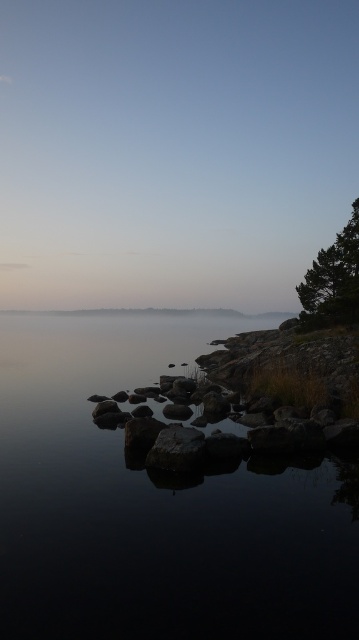
Question: Which of the following is the closest to the observer?

Choices:
 (A) (190, 465)
 (B) (193, 316)

Answer: (A)

Question: Where is transparent water at center located in relation to green textured tree at right in the image?

Choices:
 (A) right
 (B) left

Answer: (B)

Question: Does transparent water at center have a greater width compared to smooth gray rock at center?

Choices:
 (A) no
 (B) yes

Answer: (B)

Question: Among these objects, which one is nearest to the camera?

Choices:
 (A) transparent water at center
 (B) smooth gray rock at center
 (C) green textured tree at right

Answer: (A)

Question: Which of the following is the closest to the observer?

Choices:
 (A) green textured tree at right
 (B) smooth gray rock at center

Answer: (B)

Question: Can you confirm if transparent water at center is positioned to the left of smooth gray rock at center?

Choices:
 (A) no
 (B) yes

Answer: (B)